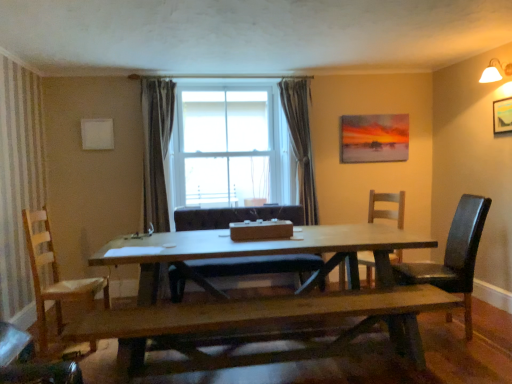
What do you see at coordinates (264, 323) in the screenshot? I see `wooden bench at center` at bounding box center [264, 323].

The width and height of the screenshot is (512, 384). What are the coordinates of `light brown wooden chair at left, the 1th chair viewed from the left` in the screenshot? It's located at (55, 277).

What do you see at coordinates (495, 72) in the screenshot?
I see `white fabric lampshade at upper right` at bounding box center [495, 72].

This screenshot has width=512, height=384. What are the coordinates of `wooden chair at right, the 3th chair when ordered from left to right` in the screenshot? It's located at (387, 209).

How much space does matte acrylic painting at upper right, which appears as the 2th picture frame when viewed from the right, occupy horizontally?

It is 2.18 inches.

What do you see at coordinates (260, 252) in the screenshot?
I see `smooth wooden table at center` at bounding box center [260, 252].

You are a GUI agent. You are given a task and a screenshot of the screen. Output one action in this format:
    pyautogui.click(x=<x>, y=<y>)
    Task: Click on the wooden picture frame at upper right, positioned as the second picture frame in left-to-right order
    The width and height of the screenshot is (512, 384).
    Given the screenshot: What is the action you would take?
    pyautogui.click(x=502, y=115)

From a real-world perspective, which is physically below, dark gray textured curtain at center or white glass window at center?

From a 3D spatial view, dark gray textured curtain at center is below.

Is dark gray textured curtain at center to the right of white glass window at center from the viewer's perspective?

Indeed, dark gray textured curtain at center is positioned on the right side of white glass window at center.

Can you confirm if dark gray textured curtain at center is bigger than white glass window at center?

No.

Is dark gray textured curtain at center oriented away from white glass window at center?

That's right, dark gray textured curtain at center is facing away from white glass window at center.

Would you say wooden chair at right, which is the second chair in right-to-left order, is part of wooden picture frame at upper right, marked as the 1th picture frame in a front-to-back arrangement,'s contents?

No.

Considering the relative sizes of wooden picture frame at upper right, positioned as the second picture frame in left-to-right order, and wooden chair at right, which is the second chair in right-to-left order, in the image provided, is wooden picture frame at upper right, positioned as the second picture frame in left-to-right order, taller than wooden chair at right, which is the second chair in right-to-left order,?

Incorrect, the height of wooden picture frame at upper right, positioned as the second picture frame in left-to-right order, is not larger of that of wooden chair at right, which is the second chair in right-to-left order.

Which is in front, wooden picture frame at upper right, which is counted as the second picture frame, starting from the back, or wooden chair at right, which is the second chair in right-to-left order?

wooden picture frame at upper right, which is counted as the second picture frame, starting from the back, is in front.

Is wooden picture frame at upper right, which is counted as the second picture frame, starting from the back, to the right of wooden chair at right, the 3th chair when ordered from left to right, from the viewer's perspective?

Indeed, wooden picture frame at upper right, which is counted as the second picture frame, starting from the back, is positioned on the right side of wooden chair at right, the 3th chair when ordered from left to right.

Is black leather chair at right, which is the 1th chair from right to left, far from matte acrylic painting at upper right, which appears as the 2th picture frame when viewed from the right?

That's right, there is a large distance between black leather chair at right, which is the 1th chair from right to left, and matte acrylic painting at upper right, which appears as the 2th picture frame when viewed from the right.

In the scene shown: Can you confirm if black leather chair at right, which is the 1th chair from right to left, is smaller than matte acrylic painting at upper right, placed as the 1th picture frame when sorted from left to right?

Actually, black leather chair at right, which is the 1th chair from right to left, might be larger than matte acrylic painting at upper right, placed as the 1th picture frame when sorted from left to right.

Image resolution: width=512 pixels, height=384 pixels. I want to click on the 4th chair in front of the matte acrylic painting at upper right, placed as the 1th picture frame when sorted from left to right, counting from the anchor's position, so click(453, 256).

From their relative heights in the image, would you say black leather chair at right, which is the 1th chair from right to left, is taller or shorter than matte acrylic painting at upper right, placed as the 1th picture frame when sorted from left to right?

Considering their sizes, black leather chair at right, which is the 1th chair from right to left, has more height than matte acrylic painting at upper right, placed as the 1th picture frame when sorted from left to right.

Which of these two, white fabric lampshade at upper right or dark gray textured curtain at center, stands taller?

dark gray textured curtain at center.

What's the angular difference between white fabric lampshade at upper right and dark gray textured curtain at center's facing directions?

→ The facing directions of white fabric lampshade at upper right and dark gray textured curtain at center are 95.4 degrees apart.

From a real-world perspective, does white fabric lampshade at upper right sit lower than dark gray textured curtain at center?

No, from a real-world perspective, white fabric lampshade at upper right is not beneath dark gray textured curtain at center.

Does point (309, 137) come behind point (383, 131)?

No, (309, 137) is closer to viewer.

Based on the photo, which object is more forward, dark gray textured curtain at center or matte acrylic painting at upper right, placed as the 1th picture frame when sorted from left to right?

dark gray textured curtain at center.

From the image's perspective, which is above, dark gray textured curtain at center or matte acrylic painting at upper right, which appears as the 2th picture frame when viewed from the right?

matte acrylic painting at upper right, which appears as the 2th picture frame when viewed from the right, is shown above in the image.

I want to click on curtain below the matte acrylic painting at upper right, which appears as the 2th picture frame when viewed from the right (from the image's perspective), so click(x=300, y=142).

From the image's perspective, who appears lower, smooth wooden table at center or wooden picture frame at upper right, positioned as the second picture frame in left-to-right order?

smooth wooden table at center, from the image's perspective.

Is point (127, 257) farther from viewer compared to point (504, 109)?

No, (127, 257) is in front of (504, 109).

From the picture: Can you confirm if smooth wooden table at center is bigger than wooden picture frame at upper right, which is counted as the second picture frame, starting from the back?

Correct, smooth wooden table at center is larger in size than wooden picture frame at upper right, which is counted as the second picture frame, starting from the back.

Is smooth wooden table at center behind wooden picture frame at upper right, which is counted as the second picture frame, starting from the back?

No, smooth wooden table at center is in front of wooden picture frame at upper right, which is counted as the second picture frame, starting from the back.

Between wooden picture frame at upper right, marked as the 1th picture frame in a front-to-back arrangement, and matte acrylic painting at upper right, the 1th picture frame from the back, which one has less height?

With less height is wooden picture frame at upper right, marked as the 1th picture frame in a front-to-back arrangement.

At what (x,y) coordinates should I click in order to perform the action: click on picture frame above the matte acrylic painting at upper right, acting as the second picture frame starting from the front (from a real-world perspective). Please return your answer as a coordinate pair (x, y). This screenshot has width=512, height=384. Looking at the image, I should click on (502, 115).

What's the angular difference between wooden picture frame at upper right, acting as the first picture frame starting from the right, and matte acrylic painting at upper right, which appears as the 2th picture frame when viewed from the right,'s facing directions?

90 degrees.

Based on the photo, is wooden picture frame at upper right, acting as the first picture frame starting from the right, facing towards matte acrylic painting at upper right, the 1th picture frame from the back?

No, wooden picture frame at upper right, acting as the first picture frame starting from the right, is not facing towards matte acrylic painting at upper right, the 1th picture frame from the back.

Locate an element on the screen. curtain below the white glass window at center (from the image's perspective) is located at coordinates (300, 142).

There is a wooden chair at right, the 3th chair when ordered from left to right. Identify the location of the 2nd picture frame above it (from a real-world perspective). The width and height of the screenshot is (512, 384). (502, 115).

From the image, which object appears to be farther from white fabric lampshade at upper right, matte acrylic painting at upper right, acting as the second picture frame starting from the front, or white glass window at center?

The object further to white fabric lampshade at upper right is white glass window at center.

Considering their positions, is matte acrylic painting at upper right, which appears as the 2th picture frame when viewed from the right, positioned further to smooth wooden table at center than light brown wooden chair at left, the 1th chair viewed from the left?

Based on the image, matte acrylic painting at upper right, which appears as the 2th picture frame when viewed from the right, appears to be further to smooth wooden table at center.

Estimate the real-world distances between objects in this image. Which object is closer to wooden bench at center, dark gray textured curtain at center or light brown wooden chair at left, the 4th chair positioned from the right?

The object closer to wooden bench at center is light brown wooden chair at left, the 4th chair positioned from the right.

Based on their spatial positions, is light brown wooden chair at left, the 4th chair positioned from the right, or black leather chair at right, which is the 1th chair from right to left, further from wooden bench at center?

The object further to wooden bench at center is light brown wooden chair at left, the 4th chair positioned from the right.

Looking at the image, which one is located closer to wooden bench at center, white glass window at center or black leather chair at right, which is the 1th chair from right to left?

black leather chair at right, which is the 1th chair from right to left, lies closer to wooden bench at center than the other object.

Considering their positions, is white glass window at center positioned closer to dark gray textured curtain at center than wooden chair at right, which is the second chair in right-to-left order?

Among the two, white glass window at center is located nearer to dark gray textured curtain at center.

Based on their spatial positions, is black leather chair at right, which is the 1th chair from right to left, or matte acrylic painting at upper right, placed as the 1th picture frame when sorted from left to right, further from wooden picture frame at upper right, positioned as the second picture frame in left-to-right order?

Based on the image, matte acrylic painting at upper right, placed as the 1th picture frame when sorted from left to right, appears to be further to wooden picture frame at upper right, positioned as the second picture frame in left-to-right order.

Consider the image. Estimate the real-world distances between objects in this image. Which object is closer to white glass window at center, wooden picture frame at upper right, which is counted as the second picture frame, starting from the back, or smooth brown leather chair at center, which appears as the third chair when viewed from the right?

smooth brown leather chair at center, which appears as the third chair when viewed from the right, is positioned closer to the anchor white glass window at center.

Locate an element on the screen. The image size is (512, 384). picture frame between light brown wooden chair at left, the 1th chair viewed from the left, and black leather chair at right, the 4th chair in the left-to-right sequence, in the horizontal direction is located at coordinates (374, 138).

Locate an element on the screen. This screenshot has width=512, height=384. lamp between white glass window at center and wooden picture frame at upper right, positioned as the second picture frame in left-to-right order is located at coordinates (495, 72).

You are a GUI agent. You are given a task and a screenshot of the screen. Output one action in this format:
    pyautogui.click(x=<x>, y=<y>)
    Task: Click on the window located between wooden bench at center and matte acrylic painting at upper right, the 1th picture frame from the back, in the depth direction
    
    Given the screenshot: What is the action you would take?
    click(231, 148)

The image size is (512, 384). I want to click on kitchen & dining room table between light brown wooden chair at left, the 4th chair positioned from the right, and wooden picture frame at upper right, marked as the 1th picture frame in a front-to-back arrangement, so click(260, 252).